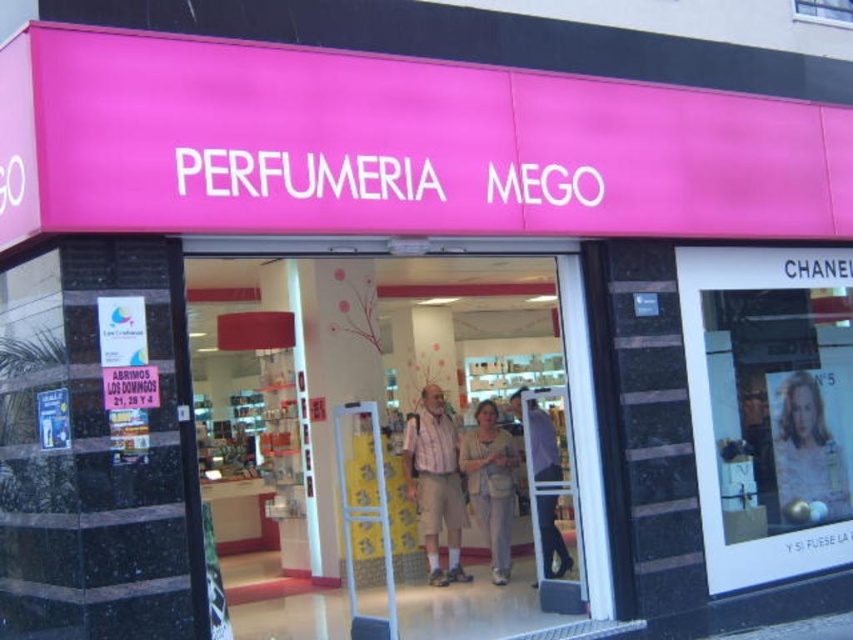
Question: Is smooth plastic poster at center smaller than plaid shirt at center?

Choices:
 (A) no
 (B) yes

Answer: (B)

Question: Which point is closer to the camera?

Choices:
 (A) matte glass door at center
 (B) light brown leather jacket at center
 (C) light beige fabric dress at center
 (D) smooth plastic poster at center

Answer: (B)

Question: In this image, where is matte glass door at center located relative to light beige fabric dress at center?

Choices:
 (A) below
 (B) above

Answer: (A)

Question: Among these objects, which one is farthest from the camera?

Choices:
 (A) matte glass door at center
 (B) plaid shirt at center
 (C) smooth plastic poster at center
 (D) light brown leather jacket at center

Answer: (A)

Question: Is plaid shirt at center in front of light beige fabric dress at center?

Choices:
 (A) yes
 (B) no

Answer: (B)

Question: Which point is farther from the camera taking this photo?

Choices:
 (A) pyautogui.click(x=532, y=452)
 (B) pyautogui.click(x=505, y=531)
 (C) pyautogui.click(x=436, y=448)

Answer: (C)